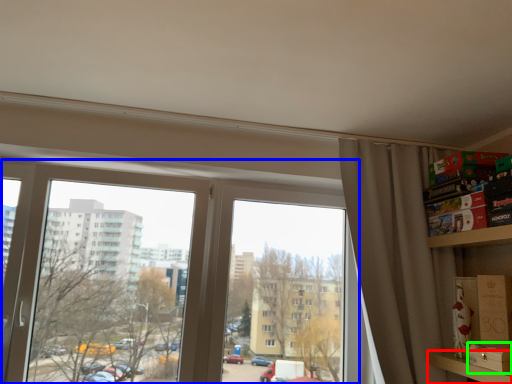
Question: Based on their relative distances, which object is farther from shelf (highlighted by a red box)? Choose from window (highlighted by a blue box) and cardboard box (highlighted by a green box).

Choices:
 (A) window
 (B) cardboard box

Answer: (A)